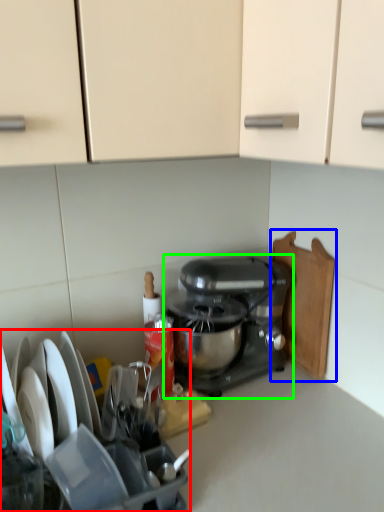
Question: Which is nearer to the appliance (highlighted by a red box)? cutting board (highlighted by a blue box) or mixer (highlighted by a green box).

Choices:
 (A) cutting board
 (B) mixer

Answer: (B)